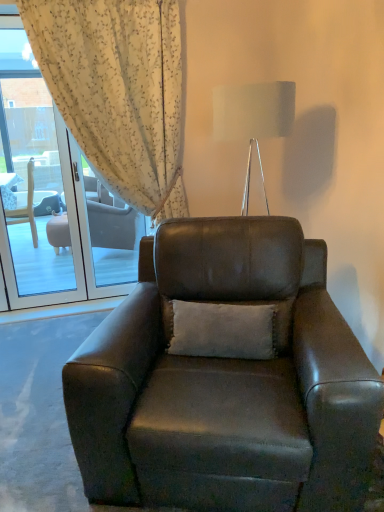
Question: Is leather armchair at center looking in the opposite direction of metallic silver lamp at upper center?

Choices:
 (A) yes
 (B) no

Answer: (B)

Question: From a real-world perspective, is leather armchair at center located beneath metallic silver lamp at upper center?

Choices:
 (A) yes
 (B) no

Answer: (A)

Question: Is leather armchair at center further to the viewer compared to metallic silver lamp at upper center?

Choices:
 (A) no
 (B) yes

Answer: (A)

Question: Would you say metallic silver lamp at upper center is part of leather armchair at center's contents?

Choices:
 (A) no
 (B) yes

Answer: (A)

Question: Is leather armchair at center not near metallic silver lamp at upper center?

Choices:
 (A) yes
 (B) no

Answer: (B)

Question: Can you confirm if leather armchair at center is thinner than metallic silver lamp at upper center?

Choices:
 (A) no
 (B) yes

Answer: (A)

Question: From a real-world perspective, is white soft cushion at center positioned over metallic silver lamp at upper center based on gravity?

Choices:
 (A) no
 (B) yes

Answer: (A)

Question: Does white soft cushion at center touch metallic silver lamp at upper center?

Choices:
 (A) no
 (B) yes

Answer: (A)

Question: Can you confirm if white soft cushion at center is wider than metallic silver lamp at upper center?

Choices:
 (A) yes
 (B) no

Answer: (B)

Question: Can you confirm if white soft cushion at center is positioned to the right of metallic silver lamp at upper center?

Choices:
 (A) yes
 (B) no

Answer: (B)

Question: Is white soft cushion at center not near metallic silver lamp at upper center?

Choices:
 (A) no
 (B) yes

Answer: (A)

Question: Is white soft cushion at center positioned behind metallic silver lamp at upper center?

Choices:
 (A) yes
 (B) no

Answer: (B)

Question: Can white soft cushion at center be found inside metallic silver lamp at upper center?

Choices:
 (A) yes
 (B) no

Answer: (B)